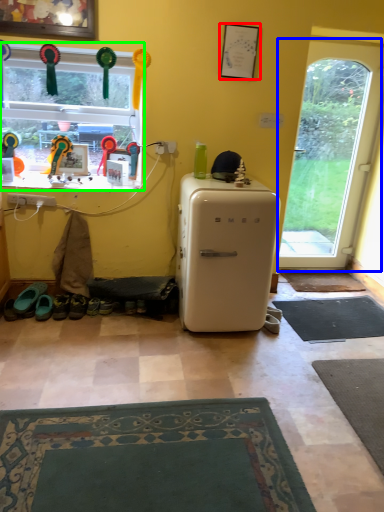
Question: Estimate the real-world distances between objects in this image. Which object is farther from picture frame (highlighted by a red box), door (highlighted by a blue box) or window (highlighted by a green box)?

Choices:
 (A) door
 (B) window

Answer: (A)